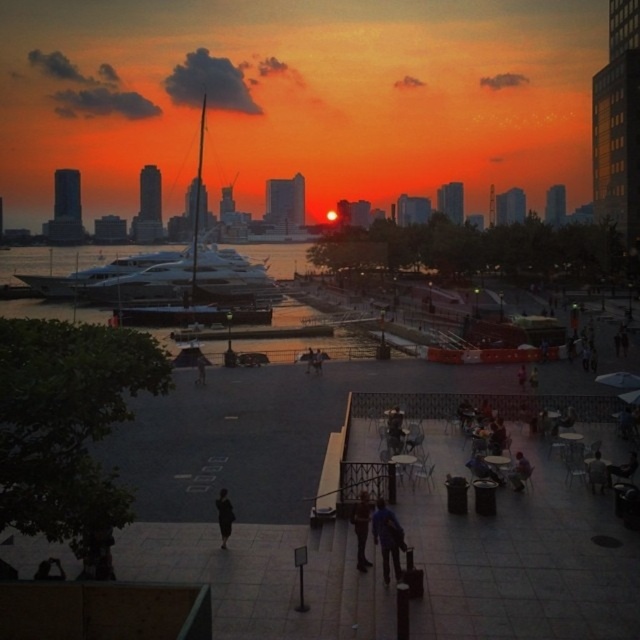
Which of these two, dark blue fabric at center or dark blue jeans at center, stands taller?

dark blue fabric at center is taller.

Which is behind, point (380, 540) or point (358, 545)?

The point (358, 545) is more distant.

Identify the location of dark blue fabric at center. (387, 538).

Can you confirm if shiny white yacht at left is bigger than dark fabric person at center?

Indeed, shiny white yacht at left has a larger size compared to dark fabric person at center.

Is point (150, 285) closer to viewer compared to point (225, 499)?

No, (150, 285) is further to viewer.

You are a GUI agent. You are given a task and a screenshot of the screen. Output one action in this format:
    pyautogui.click(x=<x>, y=<y>)
    Task: Click on the shiny white yacht at left
    This screenshot has height=640, width=640.
    Given the screenshot: What is the action you would take?
    192,282

Locate an element on the screen. The width and height of the screenshot is (640, 640). shiny white yacht at left is located at coordinates (192, 282).

Is shiny white yacht at left wider than dark blue jeans at center?

Yes.

Is point (244, 310) closer to camera compared to point (360, 518)?

No, (244, 310) is behind (360, 518).

The width and height of the screenshot is (640, 640). Find the location of `shiny white yacht at left`. shiny white yacht at left is located at coordinates (192, 282).